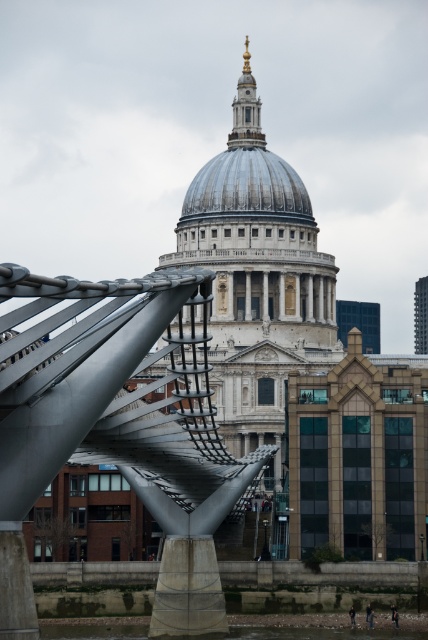
Is point (26, 577) in front of point (278, 156)?

Yes, point (26, 577) is closer to viewer.

Based on the photo, is metallic gray bridge at center further to the viewer compared to shiny silver dome at center?

No.

Image resolution: width=428 pixels, height=640 pixels. What do you see at coordinates (118, 428) in the screenshot?
I see `metallic gray bridge at center` at bounding box center [118, 428].

Find the location of a particular element. The height and width of the screenshot is (640, 428). metallic gray bridge at center is located at coordinates (118, 428).